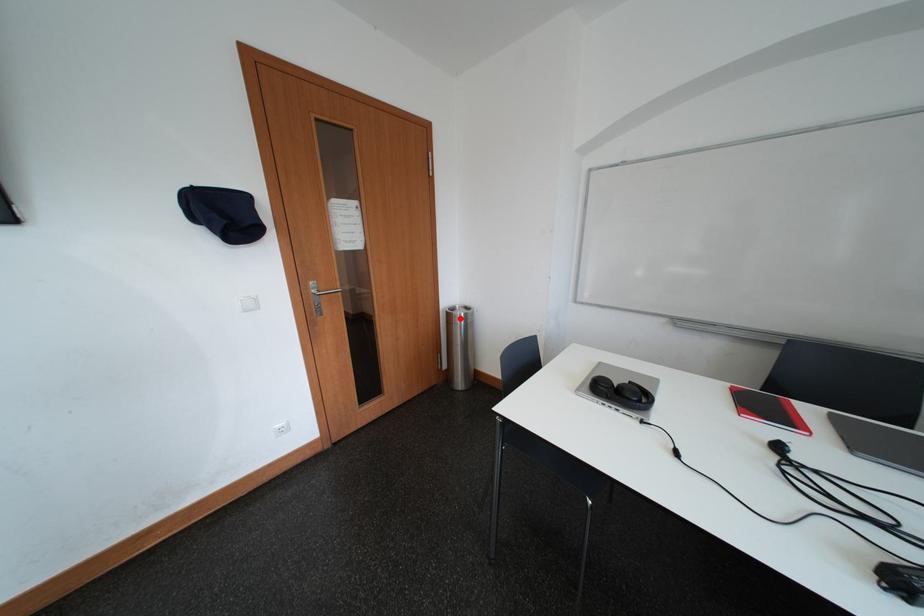
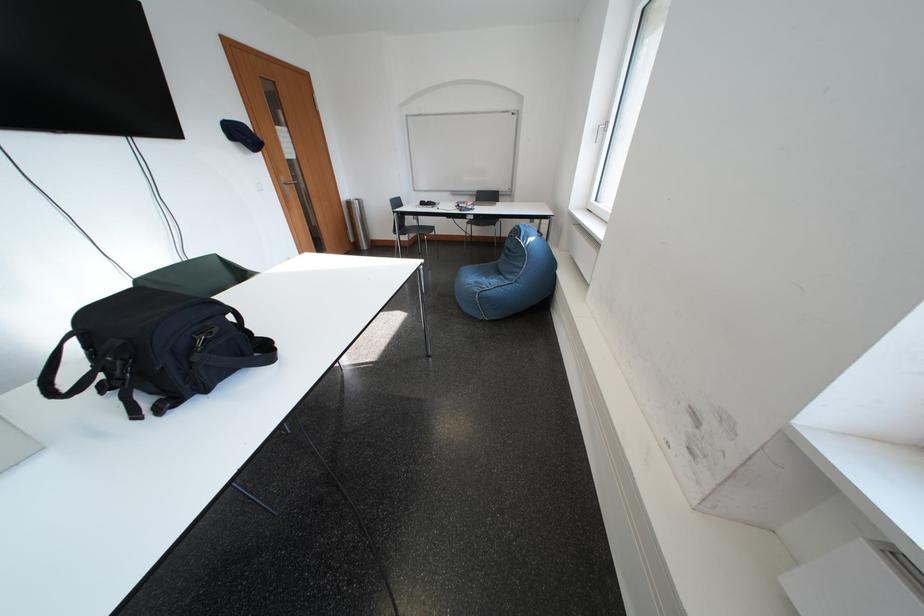
Question: I am providing you with two images of the same scene from different viewpoints. In image1, a red point is highlighted. Considering the same 3D point in image2, which of the following is correct?

Choices:
 (A) It is closer
 (B) It is farther

Answer: (A)